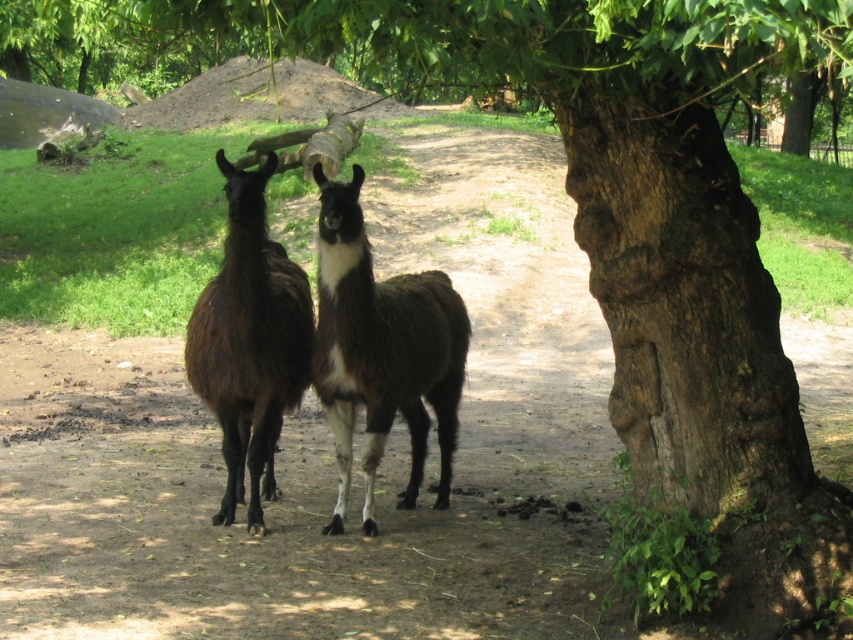
Who is lower down, brown fuzzy llama at center or brown fuzzy llama at left?

brown fuzzy llama at center is lower down.

What are the coordinates of `brown fuzzy llama at center` in the screenshot? It's located at (381, 352).